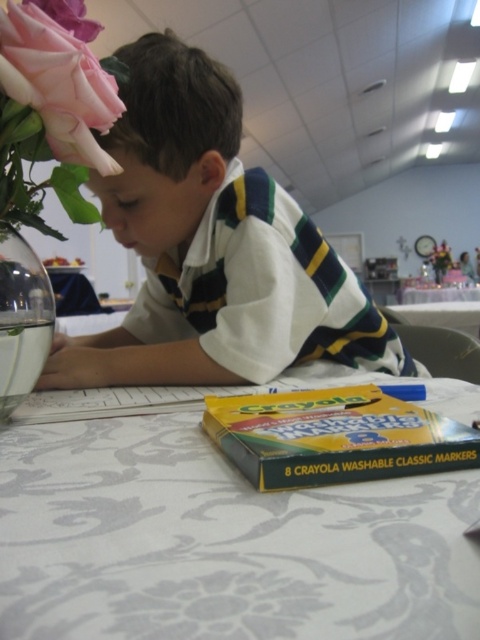
Question: Which of the following is the farthest from the observer?

Choices:
 (A) white damask tablecloth at lower center
 (B) clear glass vase at left

Answer: (B)

Question: Which object appears closest to the camera in this image?

Choices:
 (A) white damask tablecloth at lower center
 (B) pink silk flower at upper left
 (C) white striped shirt at center
 (D) yellow cardboard box of markers at lower center

Answer: (A)

Question: Does pink matte flower at upper left have a greater width compared to pink silk flower at upper left?

Choices:
 (A) yes
 (B) no

Answer: (B)

Question: Which point is farther from the camera taking this photo?

Choices:
 (A) (4, 397)
 (B) (321, 422)
 (C) (279, 330)

Answer: (C)

Question: Is white striped shirt at center wider than yellow cardboard box of markers at lower center?

Choices:
 (A) no
 (B) yes

Answer: (B)

Question: Does pink matte flower at upper left lie behind white glossy table at center?

Choices:
 (A) yes
 (B) no

Answer: (B)